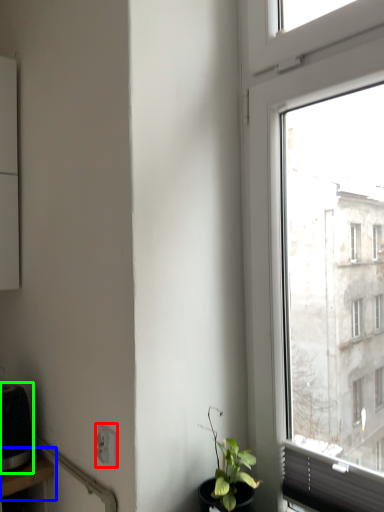
Question: Which is nearer to the power plugs and sockets (highlighted by a red box)? table (highlighted by a blue box) or appliance (highlighted by a green box).

Choices:
 (A) table
 (B) appliance

Answer: (A)